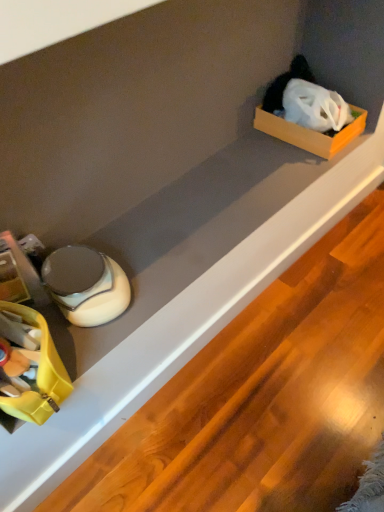
Question: Looking at their shapes, would you say yellow plastic storage box at lower left is wider or thinner than orange cardboard box at upper right?

Choices:
 (A) wide
 (B) thin

Answer: (A)

Question: Does point (13, 308) appear closer or farther from the camera than point (296, 144)?

Choices:
 (A) farther
 (B) closer

Answer: (B)

Question: Is yellow plastic storage box at lower left bigger or smaller than orange cardboard box at upper right?

Choices:
 (A) big
 (B) small

Answer: (A)

Question: In terms of height, does orange cardboard box at upper right look taller or shorter compared to yellow plastic storage box at lower left?

Choices:
 (A) short
 (B) tall

Answer: (A)

Question: From a real-world perspective, is orange cardboard box at upper right physically located above or below yellow plastic storage box at lower left?

Choices:
 (A) below
 (B) above

Answer: (A)

Question: Looking at their shapes, would you say orange cardboard box at upper right is wider or thinner than yellow plastic storage box at lower left?

Choices:
 (A) wide
 (B) thin

Answer: (B)

Question: Is orange cardboard box at upper right inside the boundaries of yellow plastic storage box at lower left, or outside?

Choices:
 (A) outside
 (B) inside

Answer: (A)